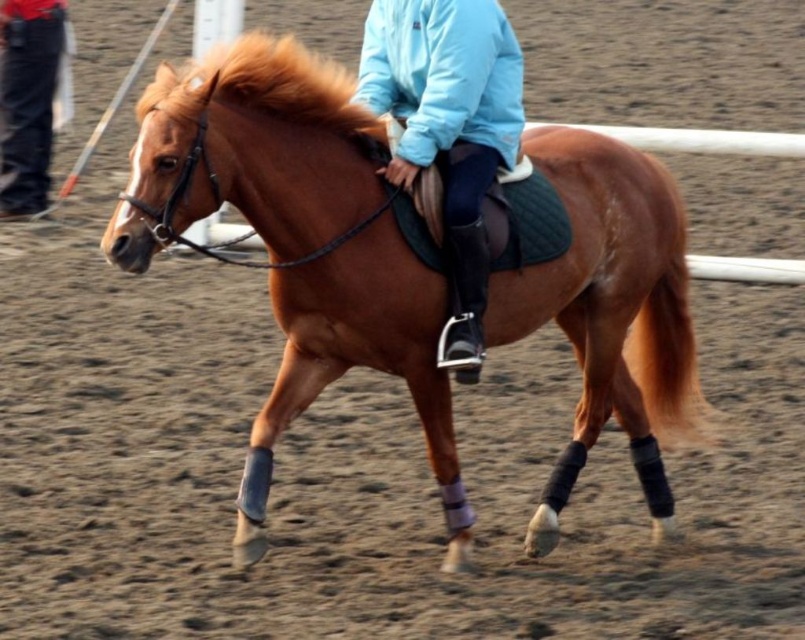
Question: Which point appears closest to the camera in this image?

Choices:
 (A) (386, 360)
 (B) (42, 157)
 (C) (172, 112)

Answer: (C)

Question: In this image, where is brown glossy horse at center located relative to black jeans at left?

Choices:
 (A) left
 (B) right

Answer: (B)

Question: Among these objects, which one is nearest to the camera?

Choices:
 (A) black jeans at left
 (B) light blue fabric jacket at center

Answer: (B)

Question: Which object is farther from the camera taking this photo?

Choices:
 (A) light blue fabric jacket at center
 (B) brown glossy horse at center
 (C) black jeans at left

Answer: (C)

Question: Can you confirm if light blue fabric jacket at center is positioned below black jeans at left?

Choices:
 (A) no
 (B) yes

Answer: (B)

Question: Does brown glossy horse at center have a larger size compared to black jeans at left?

Choices:
 (A) no
 (B) yes

Answer: (B)